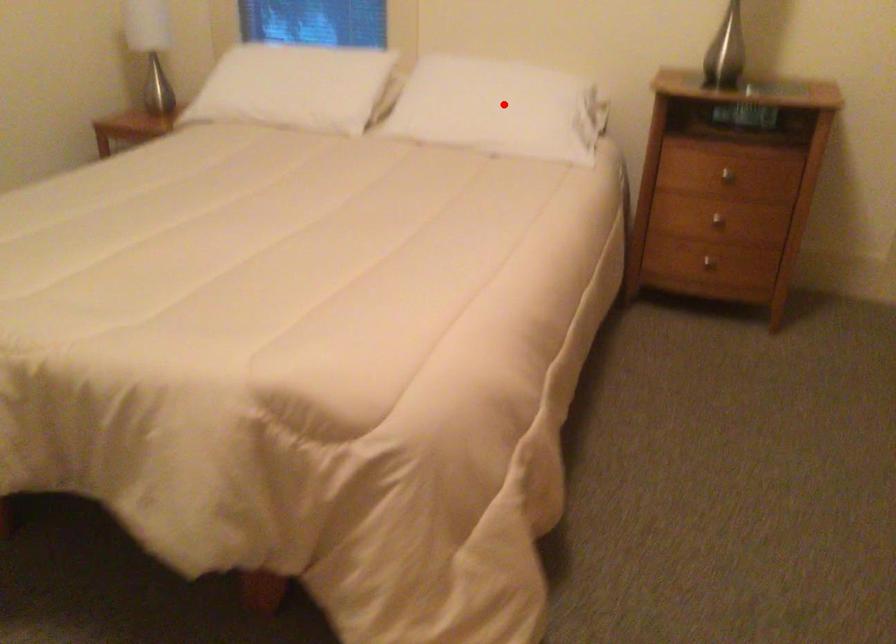
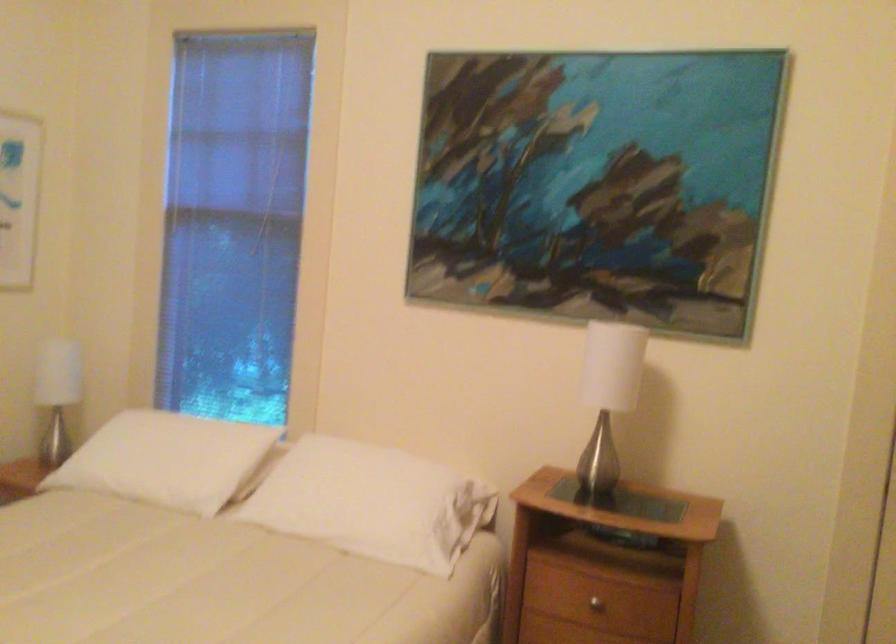
Where in the second image is the point corresponding to the highlighted location from the first image?

(373, 502)